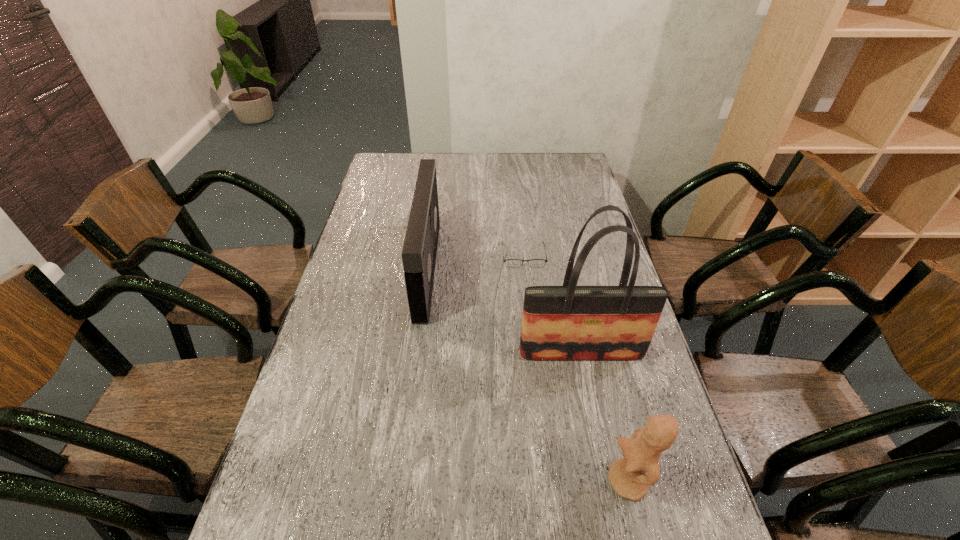
This screenshot has height=540, width=960. What are the coordinates of `the tallest object` in the screenshot? It's located at (569, 322).

Where is `the second nearest object`? the second nearest object is located at coordinates (569, 322).

Where is `videotape`? The width and height of the screenshot is (960, 540). videotape is located at coordinates (419, 251).

The image size is (960, 540). I want to click on the nearest object, so click(630, 476).

Where is `spectacles`? spectacles is located at coordinates (508, 262).

Locate an element on the screen. vacant space situated on the front-facing side of the shopping bag is located at coordinates (619, 534).

The width and height of the screenshot is (960, 540). In order to click on vacant region located 0.340m on the front side of the leftmost object in this screenshot , I will do `click(539, 269)`.

Where is `free space located 0.290m on the front-facing side of the nearest object`? This screenshot has height=540, width=960. free space located 0.290m on the front-facing side of the nearest object is located at coordinates (474, 481).

Locate an element on the screen. free spot located 0.110m on the front-facing side of the nearest object is located at coordinates (557, 481).

Locate an element on the screen. The image size is (960, 540). free region located on the front-facing side of the nearest object is located at coordinates (585, 481).